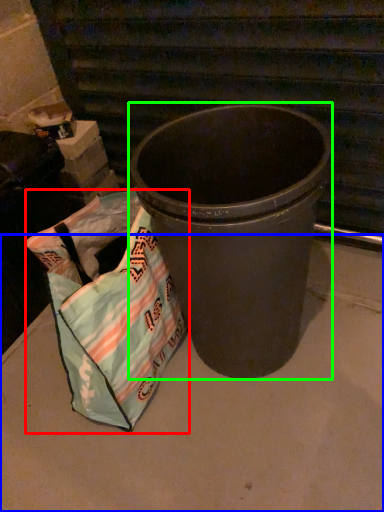
Question: Estimate the real-world distances between objects in this image. Which object is farther from grocery bag (highlighted by a red box), concrete (highlighted by a blue box) or waste container (highlighted by a green box)?

Choices:
 (A) concrete
 (B) waste container

Answer: (A)